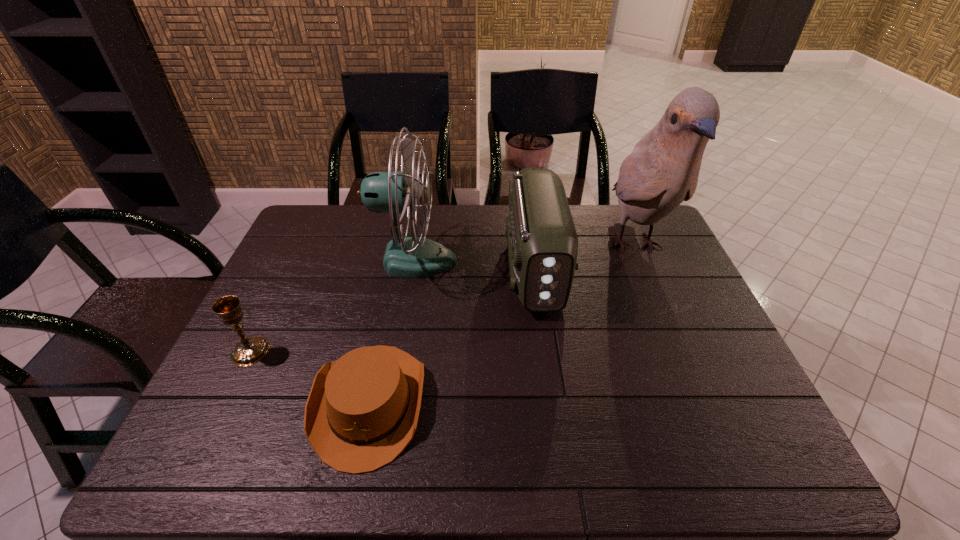
Where is `free space located 0.160m on the front-facing side of the second object from right to left`? The width and height of the screenshot is (960, 540). free space located 0.160m on the front-facing side of the second object from right to left is located at coordinates (548, 368).

Identify the location of vacant space situated on the right of the chalice. (368, 352).

Identify the location of parakeet present at the far edge. This screenshot has height=540, width=960. click(x=662, y=171).

What are the coordinates of `fan that is at the far edge` in the screenshot? It's located at (393, 192).

Identify the location of radio_receiver that is positioned at the far edge. (542, 242).

I want to click on object located at the near edge, so click(362, 411).

This screenshot has height=540, width=960. I want to click on object present at the left edge, so (x=251, y=350).

Where is `object located in the right edge section of the desktop`? This screenshot has height=540, width=960. object located in the right edge section of the desktop is located at coordinates (662, 171).

You are a GUI agent. You are given a task and a screenshot of the screen. Output one action in this format:
    pyautogui.click(x=<x>, y=<y>)
    Task: Click on the object that is at the far right corner
    This screenshot has height=540, width=960.
    Given the screenshot: What is the action you would take?
    pyautogui.click(x=662, y=171)

At what (x,y) coordinates should I click in order to perform the action: click on vacant space at the far edge of the desktop. Please return your answer as a coordinate pair (x, y). Looking at the image, I should click on (596, 226).